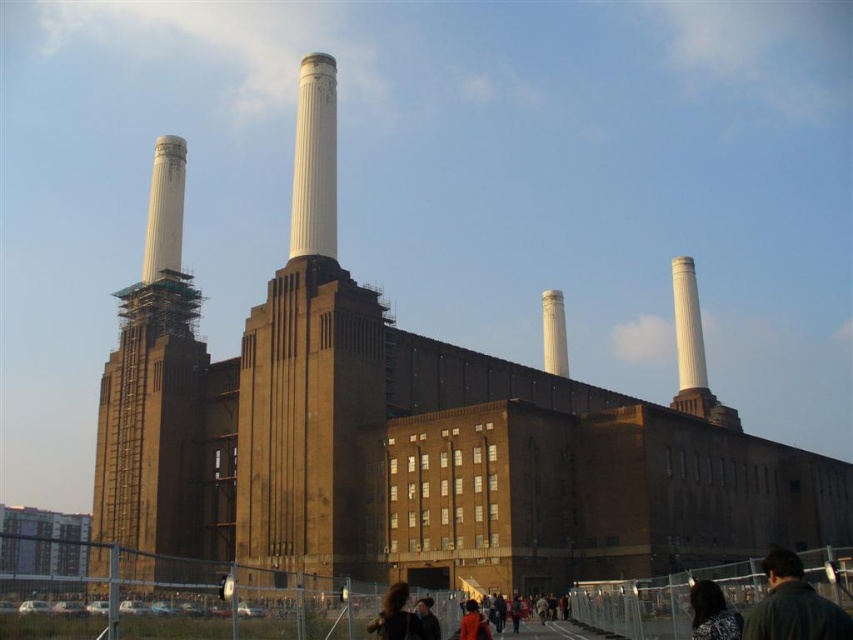
Question: Does curly brown hair at center have a lesser width compared to orange fabric jacket at lower center?

Choices:
 (A) yes
 (B) no

Answer: (B)

Question: Does patterned fabric headscarf at lower right have a smaller size compared to orange fabric jacket at lower center?

Choices:
 (A) no
 (B) yes

Answer: (A)

Question: Which is farther from the smooth white chimney at left?

Choices:
 (A) dark brown leather jacket at lower right
 (B) white smooth chimney at center

Answer: (B)

Question: Is smooth white chimney at left wider than curly brown hair at center?

Choices:
 (A) no
 (B) yes

Answer: (B)

Question: Which object appears closest to the camera in this image?

Choices:
 (A) smooth white chimney at left
 (B) brown brick tower at center

Answer: (A)

Question: Among these points, which one is nearest to the camera?

Choices:
 (A) (416, 618)
 (B) (547, 305)

Answer: (A)